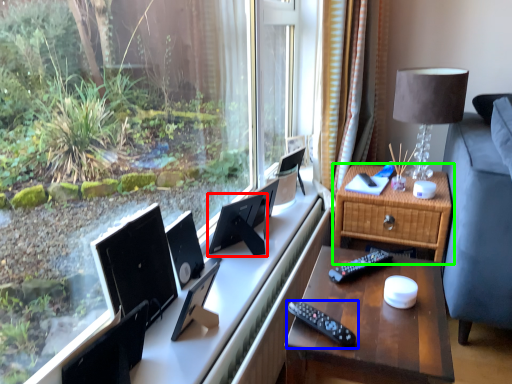
Question: Which object is the closest to the computer monitor (highlighted by a red box)? Choose among these: remote control (highlighted by a blue box) or nightstand (highlighted by a green box).

Choices:
 (A) remote control
 (B) nightstand

Answer: (B)